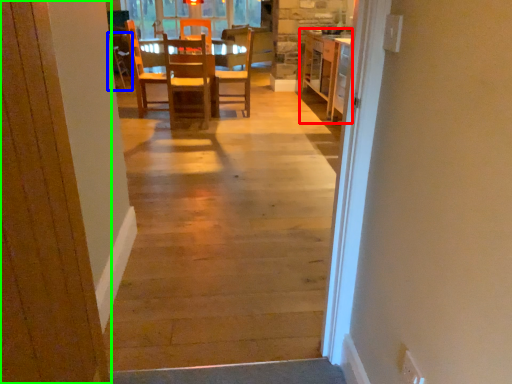
Question: Estimate the real-world distances between objects in this image. Which object is closer to cabinetry (highlighted by a red box), armchair (highlighted by a blue box) or door (highlighted by a green box)?

Choices:
 (A) armchair
 (B) door

Answer: (A)